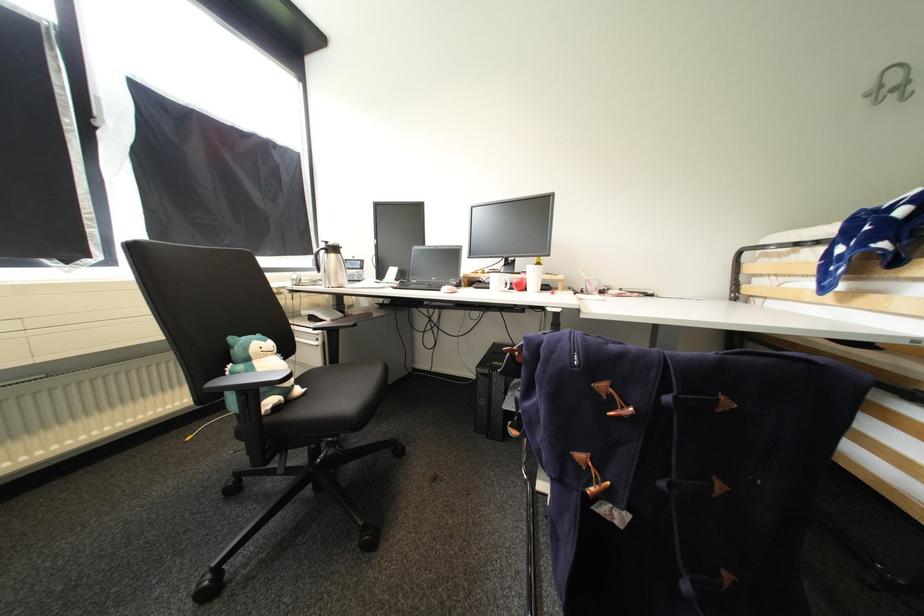
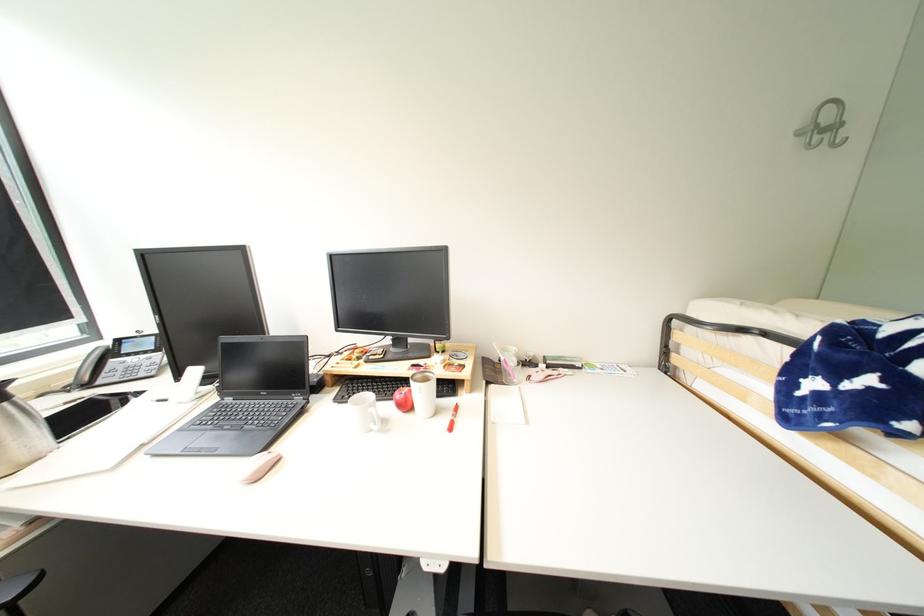
Question: The first image is from the beginning of the video and the second image is from the end. How did the camera likely rotate when shooting the video?

Choices:
 (A) Left
 (B) Right
 (C) Up
 (D) Down

Answer: (B)